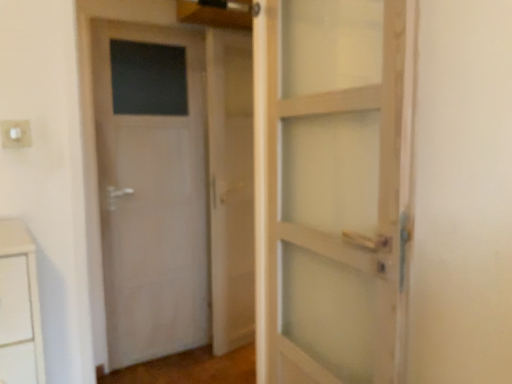
Question: In terms of height, does white matte door at left look taller or shorter compared to white plastic electric outlet at upper left?

Choices:
 (A) short
 (B) tall

Answer: (B)

Question: Choose the correct answer: Is white matte door at left inside white plastic electric outlet at upper left or outside it?

Choices:
 (A) outside
 (B) inside

Answer: (A)

Question: Which object is the closest to the white matte door at left?

Choices:
 (A) white plastic electric outlet at upper left
 (B) white wooden barn door at center

Answer: (B)

Question: Which object is the farthest from the white matte door at left?

Choices:
 (A) white wooden barn door at center
 (B) white plastic electric outlet at upper left

Answer: (B)